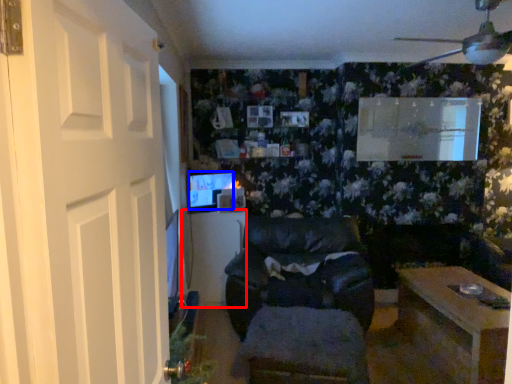
Question: Which object is closer to the camera taking this photo, table (highlighted by a red box) or computer monitor (highlighted by a blue box)?

Choices:
 (A) table
 (B) computer monitor

Answer: (B)